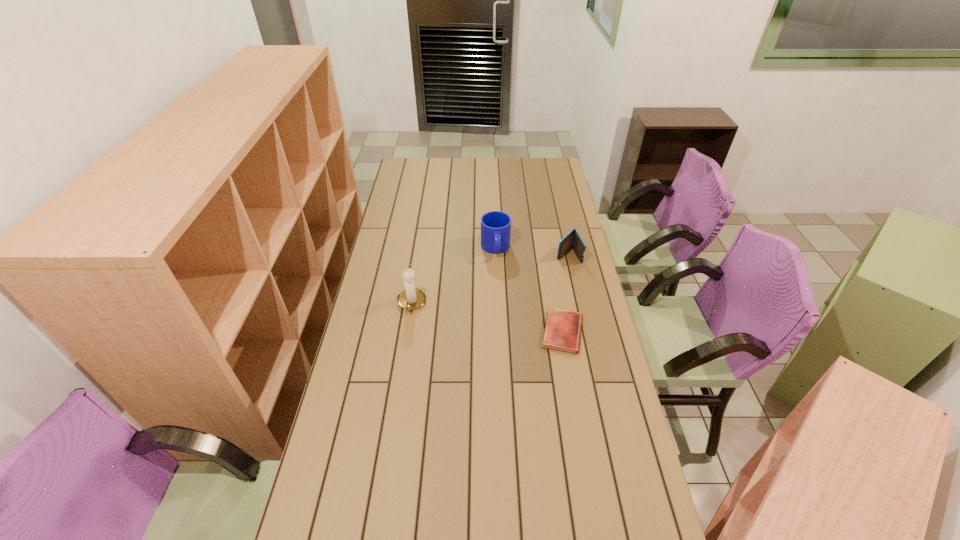
Identify the location of free spot at the right edge of the desktop. This screenshot has width=960, height=540. (568, 213).

Find the location of a particular element. This screenshot has width=960, height=540. free location at the far left corner is located at coordinates (426, 167).

Image resolution: width=960 pixels, height=540 pixels. What are the coordinates of `free location at the near left corner of the desktop` in the screenshot? It's located at (316, 525).

Locate an element on the screen. The image size is (960, 540). vacant space at the far right corner is located at coordinates point(551,176).

This screenshot has width=960, height=540. In order to click on free space between the mug and the leftmost object in this screenshot , I will do `click(453, 276)`.

Identify the location of vacant space that's between the third tallest object and the candle holder. The height and width of the screenshot is (540, 960). (490, 279).

Identify the location of unoccupied area between the candle holder and the diary. (487, 318).

This screenshot has width=960, height=540. In order to click on vacant region between the second object from left to right and the shortest object in this screenshot , I will do `click(529, 290)`.

Locate an element on the screen. The image size is (960, 540). free space that is in between the shortest object and the tallest object is located at coordinates (487, 318).

Find the location of a particular element. Image resolution: width=960 pixels, height=540 pixels. free space between the third shortest object and the second shortest object is located at coordinates (532, 252).